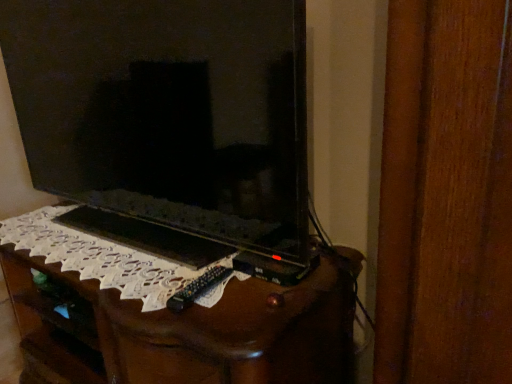
This screenshot has width=512, height=384. Describe the element at coordinates (187, 314) in the screenshot. I see `wooden tv stand at center` at that location.

What is the approximate width of wooden tv stand at center?

The width of wooden tv stand at center is 24.24 inches.

Locate an element on the screen. Image resolution: width=512 pixels, height=384 pixels. wooden tv stand at center is located at coordinates (187, 314).

The width and height of the screenshot is (512, 384). What are the coordinates of `matte black tv at center` in the screenshot? It's located at (168, 112).

Image resolution: width=512 pixels, height=384 pixels. What do you see at coordinates (168, 112) in the screenshot?
I see `matte black tv at center` at bounding box center [168, 112].

Measure the distance between point (183, 103) and camera.

Point (183, 103) and camera are 38.31 inches apart.

Locate an element on the screen. wooden tv stand at center is located at coordinates click(x=187, y=314).

In the image, is matte black tv at center on the left side or the right side of wooden tv stand at center?

matte black tv at center is to the left of wooden tv stand at center.

Relative to wooden tv stand at center, is matte black tv at center in front or behind?

Clearly, matte black tv at center is in front of wooden tv stand at center.

Which point is more distant from viewer, (220, 193) or (48, 243)?

Point (48, 243)

From the image's perspective, is matte black tv at center positioned above or below wooden tv stand at center?

matte black tv at center is situated higher than wooden tv stand at center in the image.

From a real-world perspective, which object stands above the other?

From a 3D spatial view, matte black tv at center is above.

In terms of width, does matte black tv at center look wider or thinner when compared to wooden tv stand at center?

Clearly, matte black tv at center has less width compared to wooden tv stand at center.

Considering the relative sizes of matte black tv at center and wooden tv stand at center in the image provided, is matte black tv at center shorter than wooden tv stand at center?

In fact, matte black tv at center may be taller than wooden tv stand at center.

Consider the image. Who is smaller, matte black tv at center or wooden tv stand at center?

matte black tv at center.

Choose the correct answer: Is matte black tv at center inside wooden tv stand at center or outside it?

The correct answer is: outside.

Are matte black tv at center and wooden tv stand at center located far from each other?

They are positioned close to each other.

Consider the image. Is matte black tv at center turned away from wooden tv stand at center?

That's not correct — matte black tv at center is not looking away from wooden tv stand at center.

This screenshot has width=512, height=384. Identify the location of furniture below the matte black tv at center (from the image's perspective). (187, 314).

Does wooden tv stand at center appear on the right side of matte black tv at center?

Correct, you'll find wooden tv stand at center to the right of matte black tv at center.

Looking at this image, is the depth of wooden tv stand at center less than that of matte black tv at center?

No, it is not.

Which is farther from the camera, [102,312] or [80,51]?

The point [80,51] is behind.

Looking at this image, from the image's perspective, is wooden tv stand at center on top of matte black tv at center?

No, from the image's perspective, wooden tv stand at center is not on top of matte black tv at center.

From a real-world perspective, is wooden tv stand at center positioned over matte black tv at center based on gravity?

Incorrect, from a real-world perspective, wooden tv stand at center is lower than matte black tv at center.

Does wooden tv stand at center have a lesser width compared to matte black tv at center?

No.

Is wooden tv stand at center shorter than matte black tv at center?

Indeed, wooden tv stand at center has a lesser height compared to matte black tv at center.

Who is smaller, wooden tv stand at center or matte black tv at center?

With smaller size is matte black tv at center.

In the scene shown: Is wooden tv stand at center completely or partially outside of matte black tv at center?

Yes.

Is wooden tv stand at center next to matte black tv at center?

No, wooden tv stand at center is not with matte black tv at center.

Could you tell me if wooden tv stand at center is facing matte black tv at center?

No, wooden tv stand at center is not facing towards matte black tv at center.

At what (x,y) coordinates should I click in order to perform the action: click on television located above the wooden tv stand at center (from a real-world perspective). Please return your answer as a coordinate pair (x, y). Looking at the image, I should click on (168, 112).

The height and width of the screenshot is (384, 512). What are the coordinates of `television in front of the wooden tv stand at center` in the screenshot? It's located at (168, 112).

Locate an element on the screen. The height and width of the screenshot is (384, 512). television located above the wooden tv stand at center (from the image's perspective) is located at coordinates (168, 112).